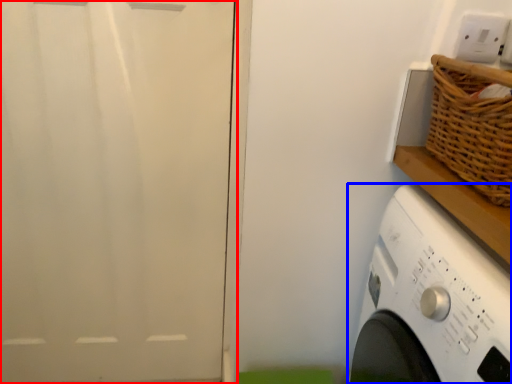
Question: Among these objects, which one is nearest to the camera, screen door (highlighted by a red box) or washing machine (highlighted by a blue box)?

Choices:
 (A) screen door
 (B) washing machine

Answer: (B)